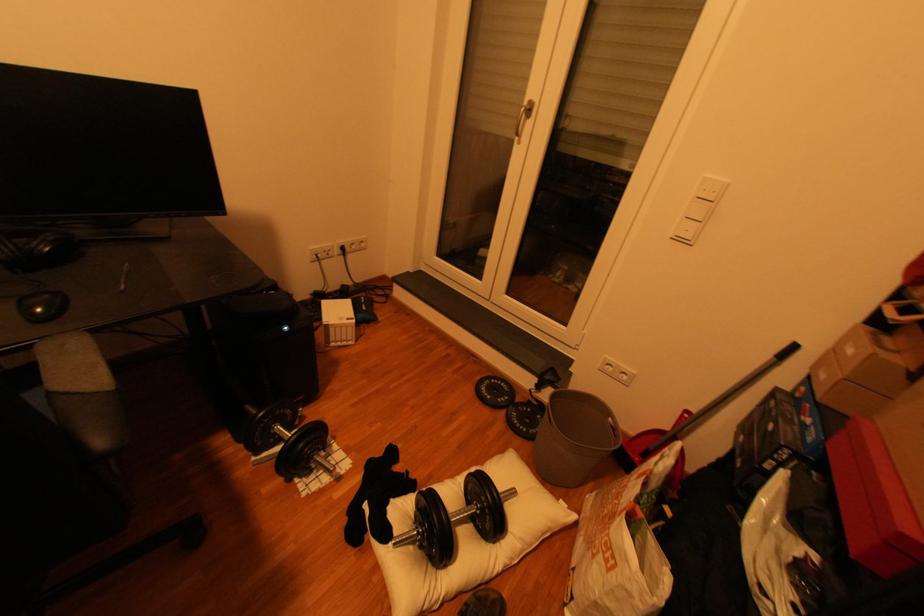
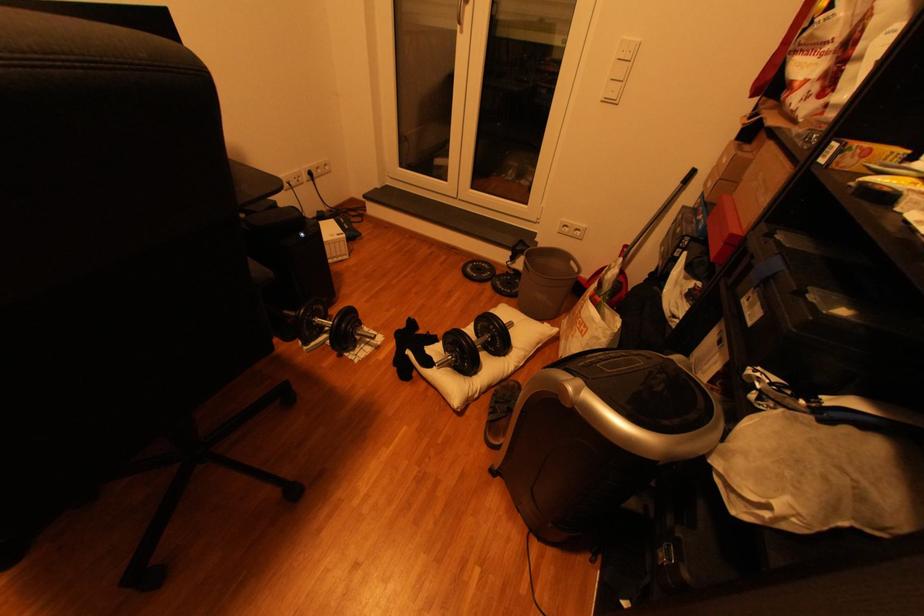
Find the pixel in the second image that matches (x=497, y=389) in the first image.

(482, 270)